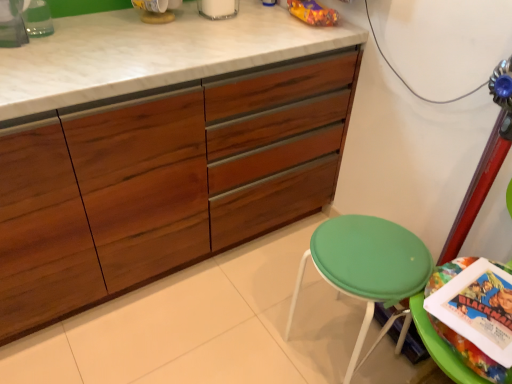
Find the location of `free space above green plastic stool at lower right (from a real-world perspective)`. free space above green plastic stool at lower right (from a real-world perspective) is located at coordinates (480, 305).